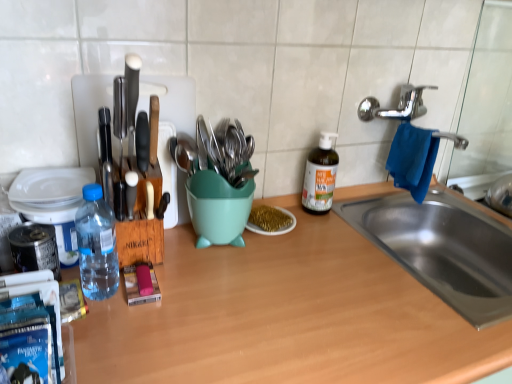
The height and width of the screenshot is (384, 512). Find the location of `vacant area that is in front of teal plastic mixing bowl at center`. vacant area that is in front of teal plastic mixing bowl at center is located at coordinates (221, 283).